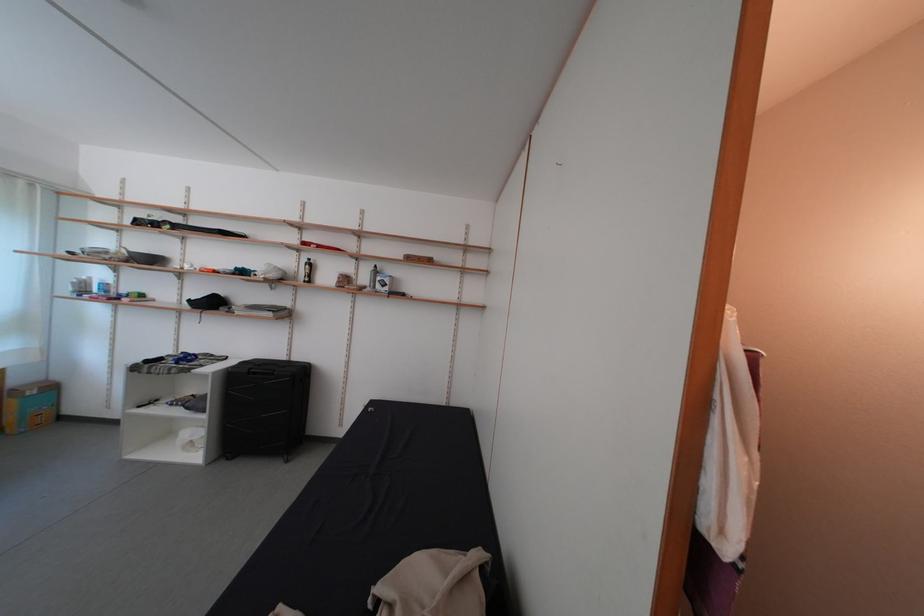
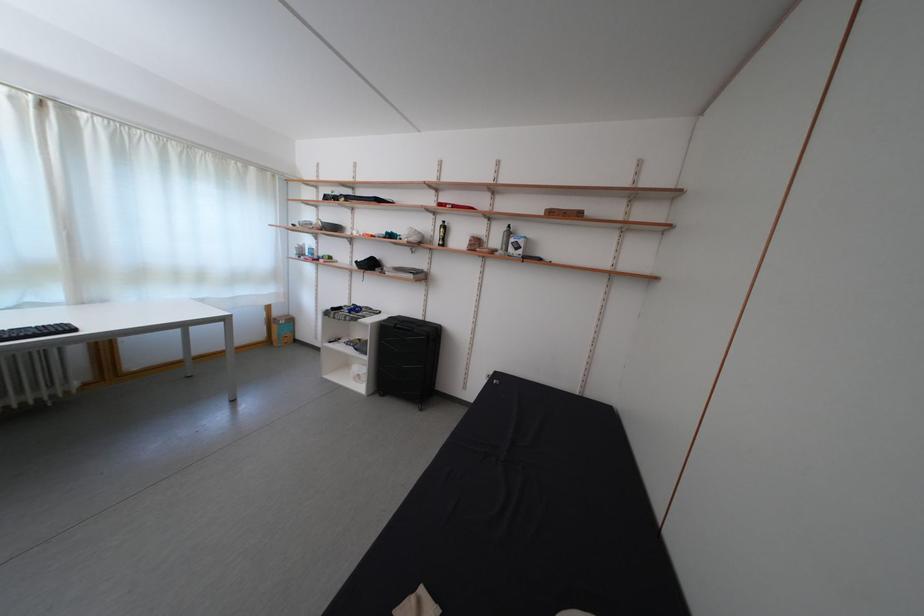
Question: How did the camera likely rotate?

Choices:
 (A) Left
 (B) Right
 (C) Up
 (D) Down

Answer: (A)